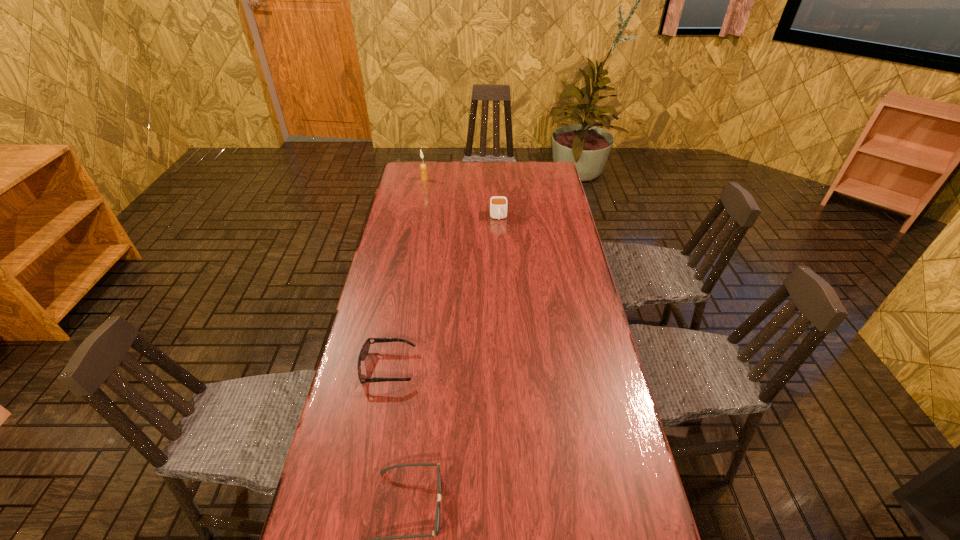
This screenshot has height=540, width=960. I want to click on sunglasses that is at the left edge, so click(x=364, y=351).

In order to click on object that is at the far left corner in this screenshot , I will do `click(423, 168)`.

Identify the location of blank space at the far edge of the desktop. This screenshot has width=960, height=540. (484, 174).

Where is `vacant area at the left edge`? vacant area at the left edge is located at coordinates (386, 268).

Find the location of a particular element. free space at the right edge of the desktop is located at coordinates (550, 282).

Where is `vacant space at the far right corner of the desktop`? This screenshot has height=540, width=960. vacant space at the far right corner of the desktop is located at coordinates (531, 182).

The height and width of the screenshot is (540, 960). I want to click on blank region between the tallest object and the second nearest object, so click(406, 273).

Where is `unoccupied position between the third farthest object and the cup`? The height and width of the screenshot is (540, 960). unoccupied position between the third farthest object and the cup is located at coordinates (444, 292).

Image resolution: width=960 pixels, height=540 pixels. What are the coordinates of `free point between the candle and the second farthest object` in the screenshot? It's located at (462, 198).

You are a GUI agent. You are given a task and a screenshot of the screen. Output one action in this format:
    pyautogui.click(x=<x>, y=<y>)
    Task: Click on the vacant point located between the cup and the farthest object
    The image size is (960, 540).
    Given the screenshot: What is the action you would take?
    pyautogui.click(x=462, y=198)